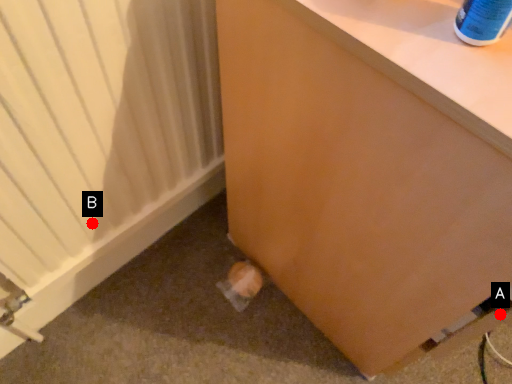
Question: Two points are circled on the image, labeled by A and B beside each circle. Which point is further to the camera?

Choices:
 (A) A is further
 (B) B is further

Answer: (B)